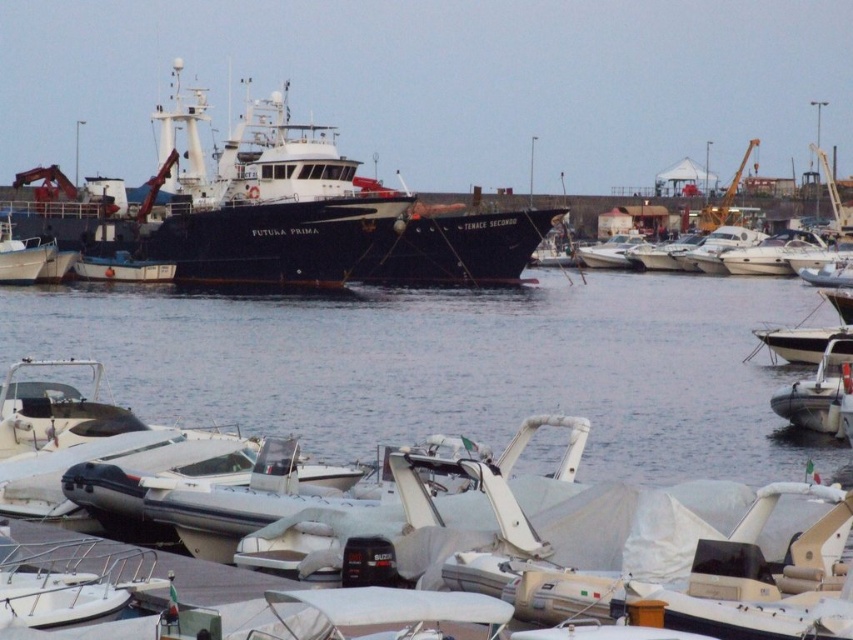
Is point (247, 195) positioned in front of point (846, 384)?

No, (247, 195) is further to viewer.

In the scene shown: Which is below, black matte ship at center or white rubber dinghy at lower right?

white rubber dinghy at lower right

You are a GUI agent. You are given a task and a screenshot of the screen. Output one action in this format:
    pyautogui.click(x=<x>, y=<y>)
    Task: Click on the black matte ship at center
    
    Given the screenshot: What is the action you would take?
    pyautogui.click(x=274, y=212)